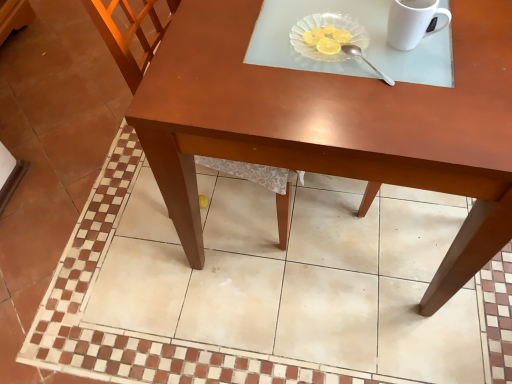
Image resolution: width=512 pixels, height=384 pixels. I want to click on free point behind transparent glass plate at upper center, so click(x=314, y=9).